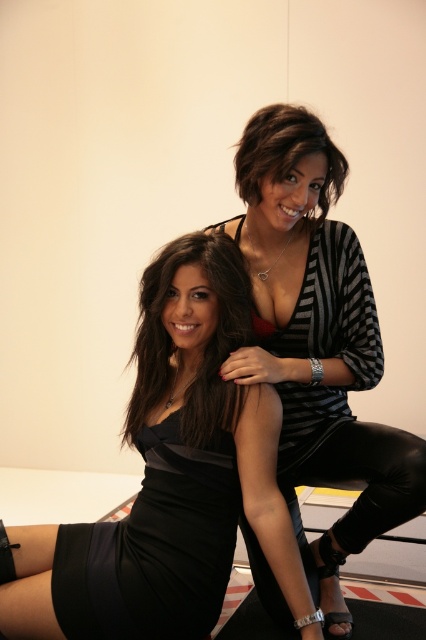
You are a photographer setting up a shoot in a room with two women. You need to place a light source to the left of the striped knit cardigan at center and to the right of the satin black dress at center. Is this possible based on their positions?

The striped knit cardigan at center is to the right of the satin black dress at center. Therefore, placing a light source to the left of the striped knit cardigan at center would also be to the right of the satin black dress at center, so yes, it is possible.

You are a fashion designer observing this image. You need to determine which object is wider between the striped knit cardigan at center and the shiny black hair at upper center. Based on the scene, which one is wider?

The striped knit cardigan at center is wider than the shiny black hair at upper center according to the description.